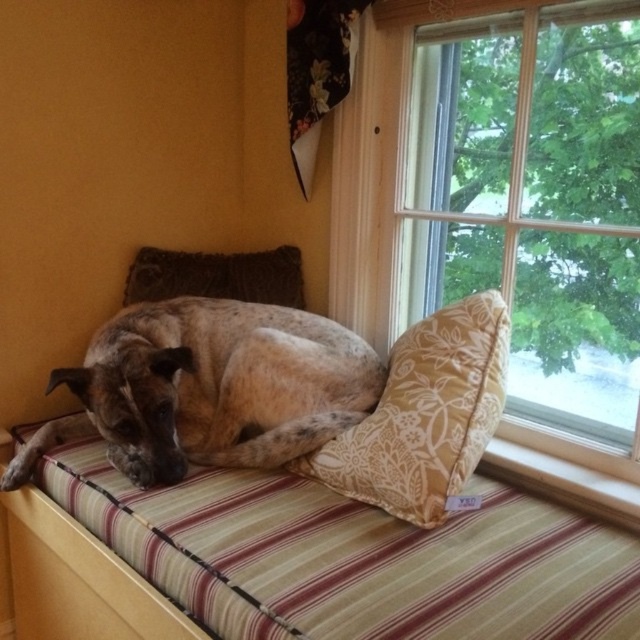
Looking at this image, can you confirm if speckled fur dog at center is positioned above velvety brown pillow at upper center?

No.

Between point (161, 380) and point (280, 275), which one is positioned in front?

Point (161, 380) is more forward.

Who is more forward, (x=285, y=422) or (x=298, y=291)?

Point (x=285, y=422) is in front.

Find the location of a particular element. This screenshot has width=640, height=640. speckled fur dog at center is located at coordinates (209, 388).

Consider the image. Who is lower down, transparent glass window at upper right or speckled fur dog at center?

speckled fur dog at center

Is transparent glass window at upper right wider than speckled fur dog at center?

Incorrect, transparent glass window at upper right's width does not surpass speckled fur dog at center's.

The image size is (640, 640). I want to click on transparent glass window at upper right, so [x=504, y=208].

Is speckled fur dog at center taller than floral fabric pillow at center?

Incorrect, speckled fur dog at center's height is not larger of floral fabric pillow at center's.

Is point (170, 426) positioned in front of point (340, 483)?

No, (170, 426) is behind (340, 483).

The image size is (640, 640). Describe the element at coordinates (209, 388) in the screenshot. I see `speckled fur dog at center` at that location.

Find the location of a particular element. Image resolution: width=640 pixels, height=640 pixels. speckled fur dog at center is located at coordinates (209, 388).